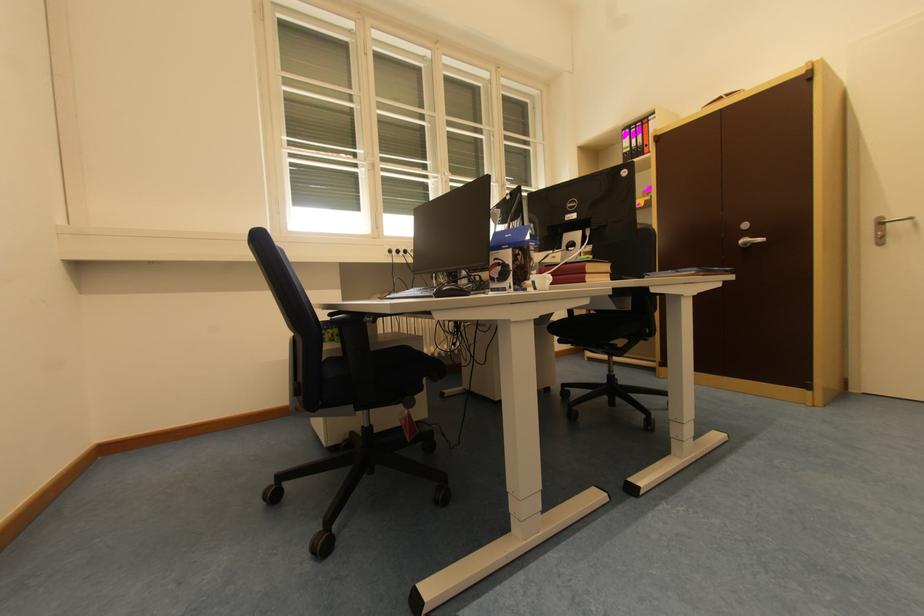
Which object does [450,291] point to?

It corresponds to the black computer mouse in the image.